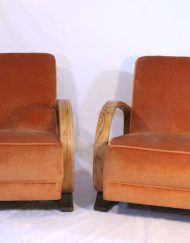
Identify the location of wooden arm rests. Image resolution: width=190 pixels, height=243 pixels. (67, 121), (97, 157).